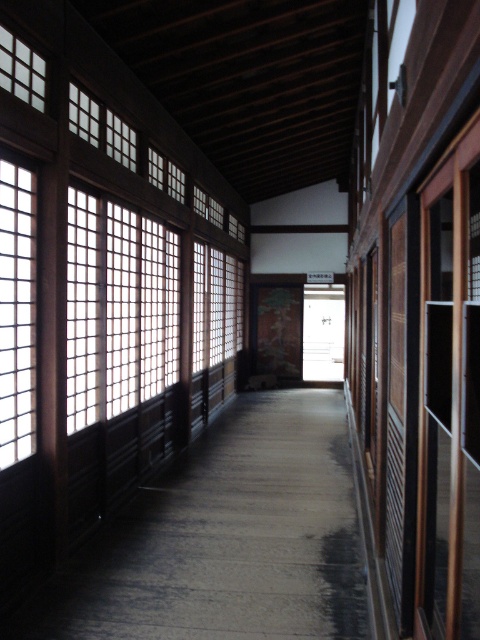
Question: Does wooden floor at center have a smaller size compared to translucent wooden lattice at upper left?

Choices:
 (A) no
 (B) yes

Answer: (A)

Question: Which of the following is the farthest from the observer?

Choices:
 (A) (169, 259)
 (B) (115, 582)
 (C) (15, 81)
 (D) (109, 132)

Answer: (A)

Question: Which point is closer to the camera?

Choices:
 (A) (9, 253)
 (B) (160, 262)
 (C) (101, 132)
 (D) (22, 84)

Answer: (A)

Question: Is translucent wooden grid at left bigger than translucent wooden grid at upper left?

Choices:
 (A) yes
 (B) no

Answer: (B)

Question: Which point is closer to the camera?

Choices:
 (A) translucent wooden lattice at upper left
 (B) translucent wooden grid at upper left
 (C) wooden floor at center

Answer: (A)

Question: Is wooden floor at center below translucent wooden lattice at upper left?

Choices:
 (A) no
 (B) yes

Answer: (B)